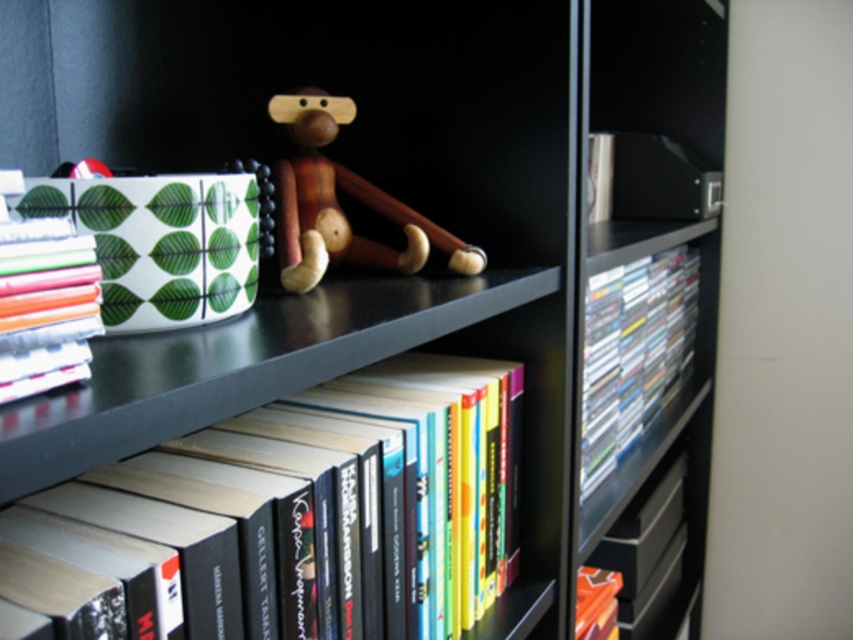
You are a librarian organizing items on a shelf. You have a wooden monkey at center and a white paper stack at left. The shelf is 20 inches wide. Can both items fit side by side without overlapping?

The wooden monkey at center is 14.01 inches from the white paper stack at left, so there is 14.01 inches between them. Since the shelf is 20 inches wide, the total space needed would be the sum of their widths plus the space between them. However, the problem states the distance between them is 14.01 inches, but we don not have individual widths. Without knowing the individual dimensions of each item, we cannot definitively determine if they can fit side by side on a 20 inch shelf. More information is neede

You are organizing items on a shelf and need to ensure that the wooden monkey at center doesn not block the view of the white paper stack at left. Since both items are on the same shelf, which one should you place further back to maintain visibility?

The wooden monkey at center should be placed further back since it is taller than the white paper stack at left, allowing the shorter white paper stack to remain visible in front.

You are a librarian trying to place a new book on the shelf. The shelf has a coordinate system where the bottom left corner is the origin. The new book needs to be placed at coordinates between 0.7 and 0.9 on the x and y axes. Can the hardcover books at center be placed there?

The hardcover books at center are already positioned at point (300, 516), which falls within the specified x and y range of 0.7 to 0.9. Therefore, the new book can be placed there.